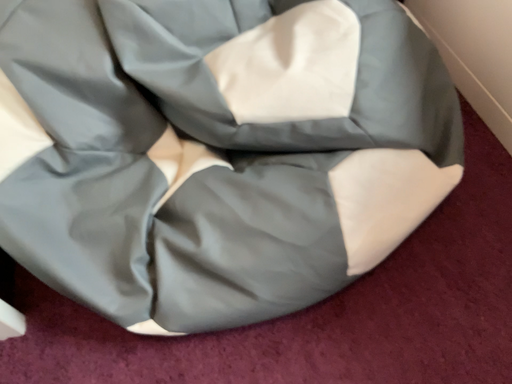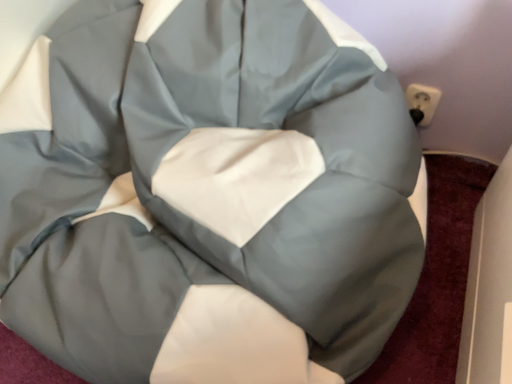
Question: Which way did the camera rotate in the video?

Choices:
 (A) rotated upward
 (B) rotated downward

Answer: (A)